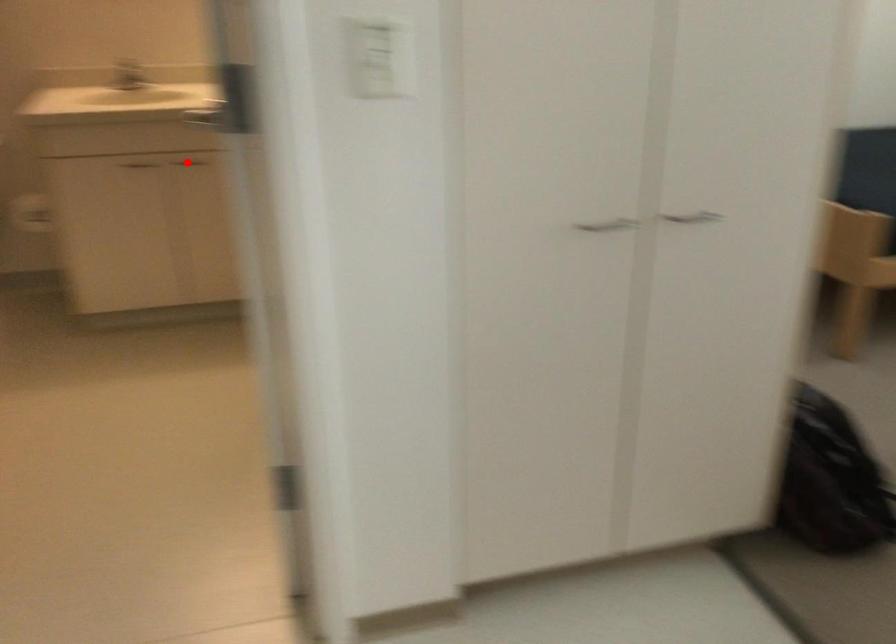
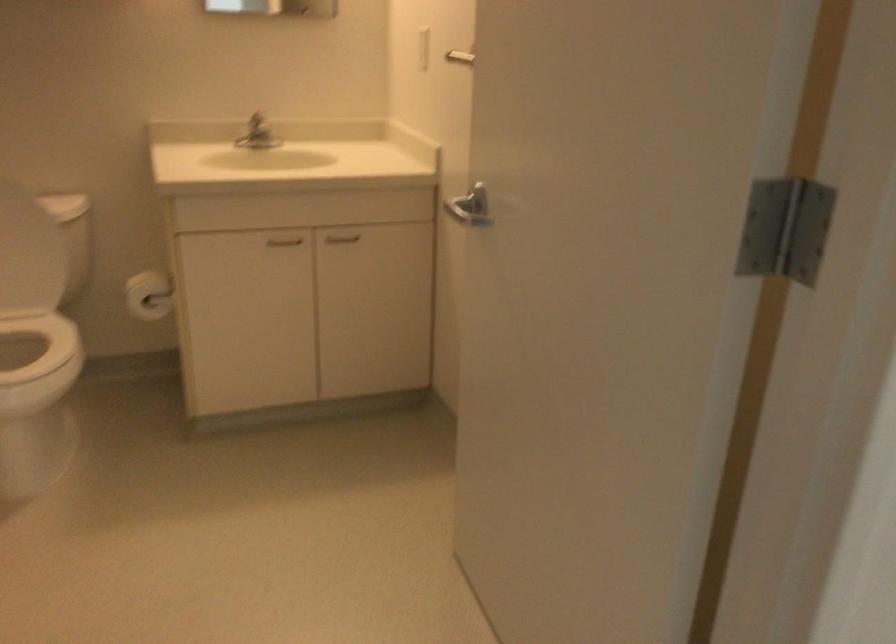
Question: I am providing you with two images of the same scene from different viewpoints. In image1, a red point is highlighted. Considering the same 3D point in image2, which of the following is correct?

Choices:
 (A) It is closer
 (B) It is farther

Answer: (A)